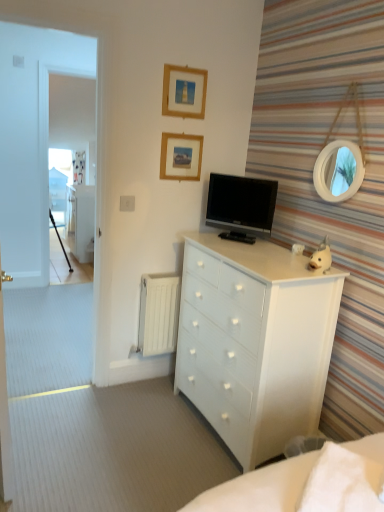
Question: Is white glossy chest of drawers at center positioned with its back to wooden picture frame at upper center, which is the first picture frame from bottom to top?

Choices:
 (A) no
 (B) yes

Answer: (A)

Question: Is white glossy chest of drawers at center thinner than wooden picture frame at upper center, which is the first picture frame from bottom to top?

Choices:
 (A) yes
 (B) no

Answer: (B)

Question: Does white glossy chest of drawers at center have a smaller size compared to wooden picture frame at upper center, which is the 2th picture frame from top to bottom?

Choices:
 (A) yes
 (B) no

Answer: (B)

Question: Would you consider white glossy chest of drawers at center to be distant from wooden picture frame at upper center, which is the 2th picture frame from top to bottom?

Choices:
 (A) no
 (B) yes

Answer: (A)

Question: Does white glossy chest of drawers at center appear on the right side of wooden picture frame at upper center, which is the 2th picture frame from top to bottom?

Choices:
 (A) no
 (B) yes

Answer: (B)

Question: From the image's perspective, is white glossy chest of drawers at center located beneath wooden picture frame at upper center, which is the first picture frame from bottom to top?

Choices:
 (A) no
 (B) yes

Answer: (B)

Question: Is wooden picture frame at upper center, which is the first picture frame from bottom to top, wider than white glossy file cabinet at left?

Choices:
 (A) no
 (B) yes

Answer: (A)

Question: From a real-world perspective, is wooden picture frame at upper center, which is the first picture frame from bottom to top, on top of white glossy file cabinet at left?

Choices:
 (A) yes
 (B) no

Answer: (A)

Question: Can you confirm if wooden picture frame at upper center, which is the 2th picture frame from top to bottom, is smaller than white glossy file cabinet at left?

Choices:
 (A) yes
 (B) no

Answer: (A)

Question: Does wooden picture frame at upper center, which is the 2th picture frame from top to bottom, appear on the left side of white glossy file cabinet at left?

Choices:
 (A) yes
 (B) no

Answer: (B)

Question: From a real-world perspective, is wooden picture frame at upper center, which is the 2th picture frame from top to bottom, positioned under white glossy file cabinet at left based on gravity?

Choices:
 (A) yes
 (B) no

Answer: (B)

Question: Considering the relative sizes of wooden picture frame at upper center, which is the first picture frame from bottom to top, and white glossy file cabinet at left in the image provided, is wooden picture frame at upper center, which is the first picture frame from bottom to top, taller than white glossy file cabinet at left?

Choices:
 (A) yes
 (B) no

Answer: (B)

Question: From a real-world perspective, is wooden picture frame at upper center, which is the 2th picture frame from top to bottom, located beneath white glossy chest of drawers at center?

Choices:
 (A) yes
 (B) no

Answer: (B)